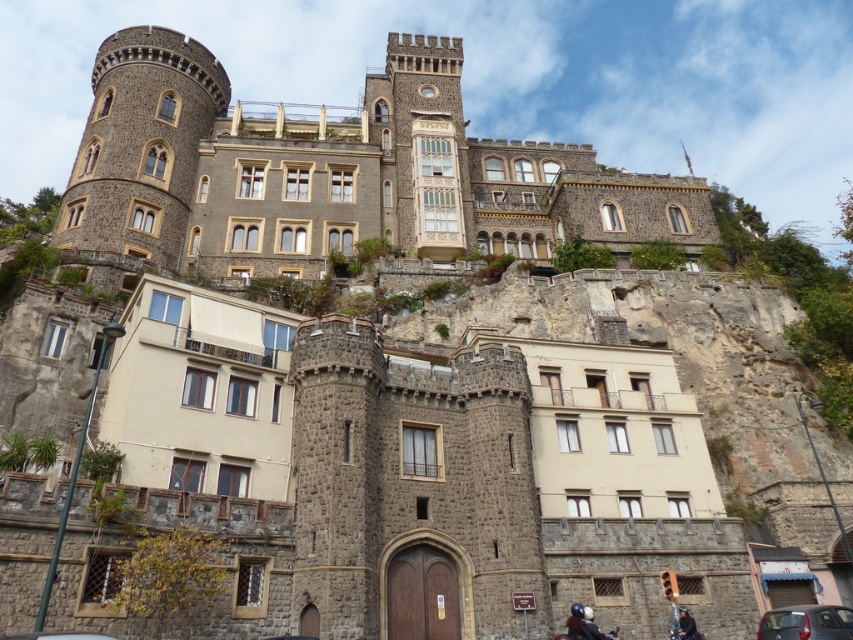
You are standing at the camera position and want to take a photo of the matte black car at lower right. Considering the distance between you and the car, can you use a standard zoom lens with a maximum range of 100 feet to capture the entire car in the frame?

The matte black car at lower right and camera are 118.51 feet apart. Since the maximum zoom range is 100 feet, the standard zoom lens cannot capture the entire car at 118.51 feet. You may need a telephoto lens for this distance.